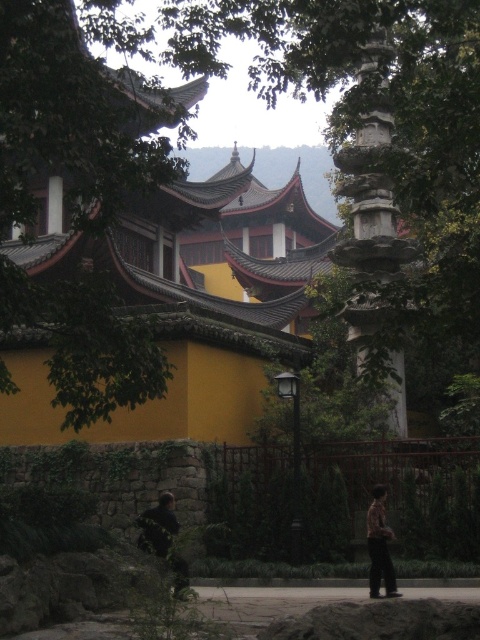
The image size is (480, 640). What do you see at coordinates (157, 525) in the screenshot? I see `dark brown leather jacket at lower center` at bounding box center [157, 525].

Which is in front, point (146, 541) or point (367, 534)?

Point (146, 541) is in front.

Which is behind, point (155, 550) or point (370, 586)?

Positioned behind is point (370, 586).

Locate an element on the screen. dark brown leather jacket at lower center is located at coordinates (157, 525).